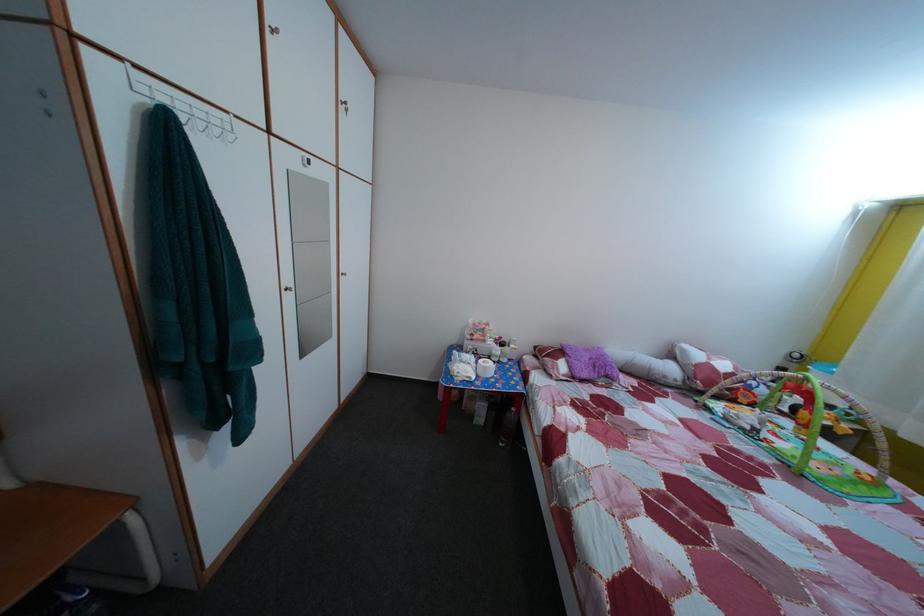
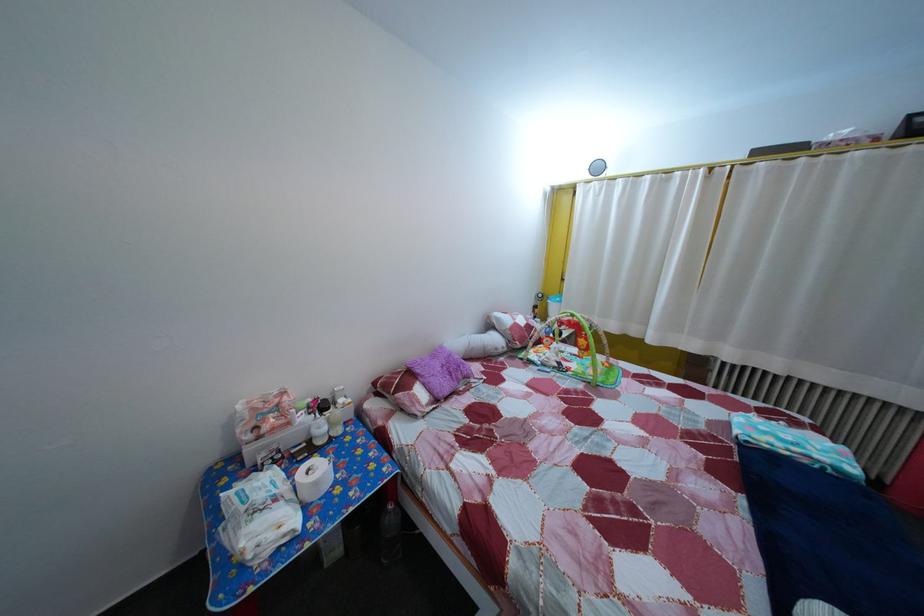
The point at [523,416] is marked in the first image. Where is the corresponding point in the second image?

(399, 515)